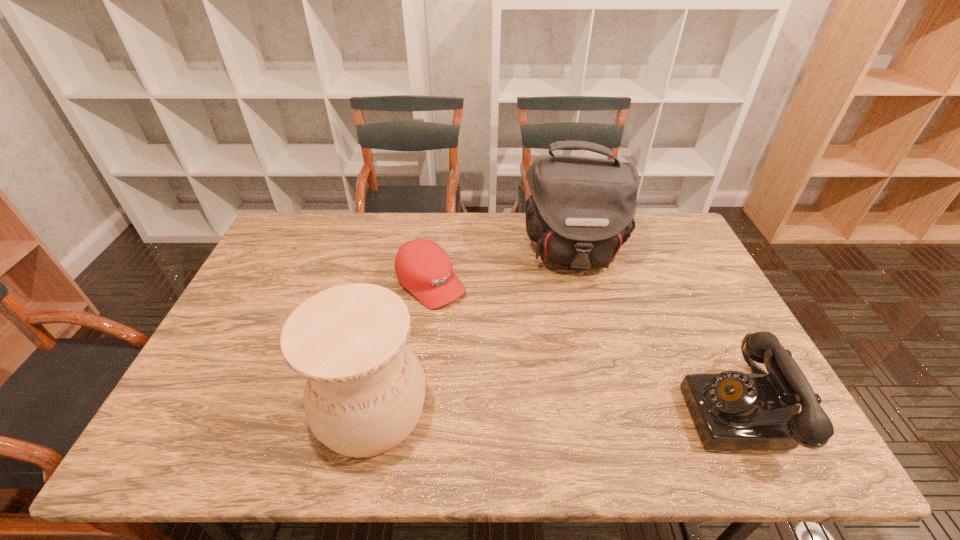
Where is `vacant area that lies between the telephone and the second object from right to left`? Image resolution: width=960 pixels, height=540 pixels. vacant area that lies between the telephone and the second object from right to left is located at coordinates (655, 332).

Locate an element on the screen. This screenshot has height=540, width=960. free point between the rightmost object and the pottery is located at coordinates (555, 409).

Where is `free space that is in between the pottery and the tallest object`? The width and height of the screenshot is (960, 540). free space that is in between the pottery and the tallest object is located at coordinates (472, 331).

The width and height of the screenshot is (960, 540). Identify the location of free space between the telephone and the cap. click(x=584, y=347).

The width and height of the screenshot is (960, 540). Identify the location of empty space that is in between the second tallest object and the rightmost object. (555, 409).

Where is `vacant space that is in between the rightmost object and the pottery`? Image resolution: width=960 pixels, height=540 pixels. vacant space that is in between the rightmost object and the pottery is located at coordinates (555, 409).

Identify the location of unoccupied area between the pottery and the second shortest object. (555, 409).

Locate which object is the second closest to the cap. Please provide its 2D coordinates. Your answer should be formatted as a tuple, i.e. [(x, y)], where the tuple contains the x and y coordinates of a point satisfying the conditions above.

[(365, 388)]

Locate an element on the screen. the third closest object to the shoulder bag is located at coordinates (365, 388).

You are a GUI agent. You are given a task and a screenshot of the screen. Output one action in this format:
    pyautogui.click(x=<x>, y=<y>)
    Task: Click on the vacant space that satisfies the following two spatial constraints: 1. on the front side of the cap; 2. on the dial of the second shortest object
    The height and width of the screenshot is (540, 960).
    Given the screenshot: What is the action you would take?
    [415, 411]